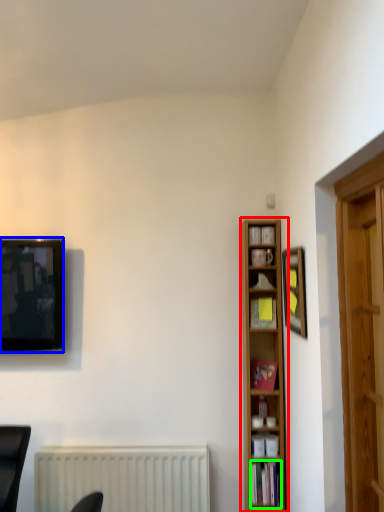
Question: Based on their relative distances, which object is nearer to bookcase (highlighted by a red box)? Choose from television (highlighted by a blue box) and book (highlighted by a green box).

Choices:
 (A) television
 (B) book

Answer: (B)